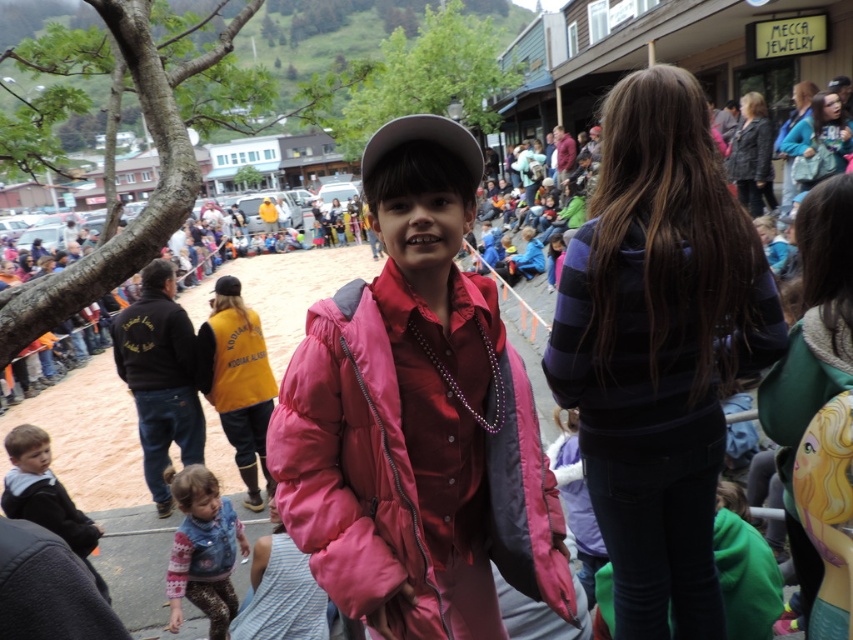
Question: Observing the image, what is the correct spatial positioning of striped sweater at center in reference to yellow fabric vest at lower left?

Choices:
 (A) below
 (B) above

Answer: (B)

Question: Considering the real-world distances, which object is closest to the gray matte baseball cap at center?

Choices:
 (A) denim vest at lower left
 (B) dark gray fleece jacket at lower left
 (C) pink puffy jacket at center

Answer: (C)

Question: Based on their relative distances, which object is nearer to the gray matte baseball cap at center?

Choices:
 (A) dark gray fleece jacket at lower left
 (B) denim vest at lower left

Answer: (B)

Question: Does pink puffy jacket at center appear on the left side of denim vest at lower left?

Choices:
 (A) yes
 (B) no

Answer: (B)

Question: Among these points, which one is farthest from the camera?

Choices:
 (A) (398, 602)
 (B) (384, 134)
 (C) (172, 492)
 (D) (252, 449)

Answer: (D)

Question: Does pink puffy jacket at center have a smaller size compared to denim vest at lower left?

Choices:
 (A) no
 (B) yes

Answer: (A)